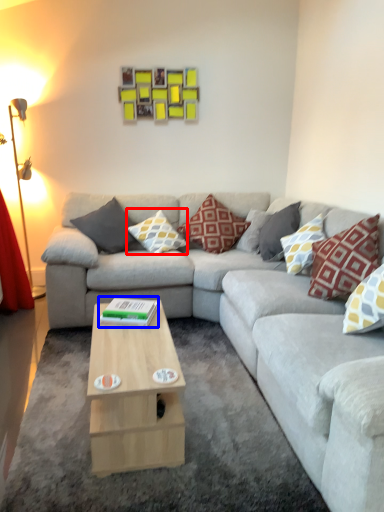
Question: Which point is further to the camera, pillow (highlighted by a red box) or book (highlighted by a blue box)?

Choices:
 (A) pillow
 (B) book

Answer: (A)